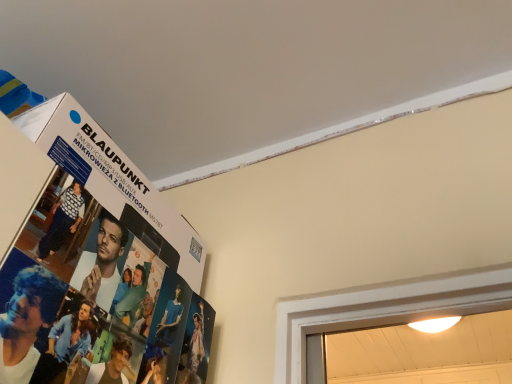
In order to face matte cardboard poster at upper left, should I rotate leftwards or rightwards?

Rotate left and turn 17.310 degrees.

Image resolution: width=512 pixels, height=384 pixels. I want to click on matte cardboard poster at upper left, so click(x=99, y=269).

Describe the element at coordinates (99, 269) in the screenshot. I see `matte cardboard poster at upper left` at that location.

This screenshot has width=512, height=384. Find the location of `matte cardboard poster at upper left`. matte cardboard poster at upper left is located at coordinates (99, 269).